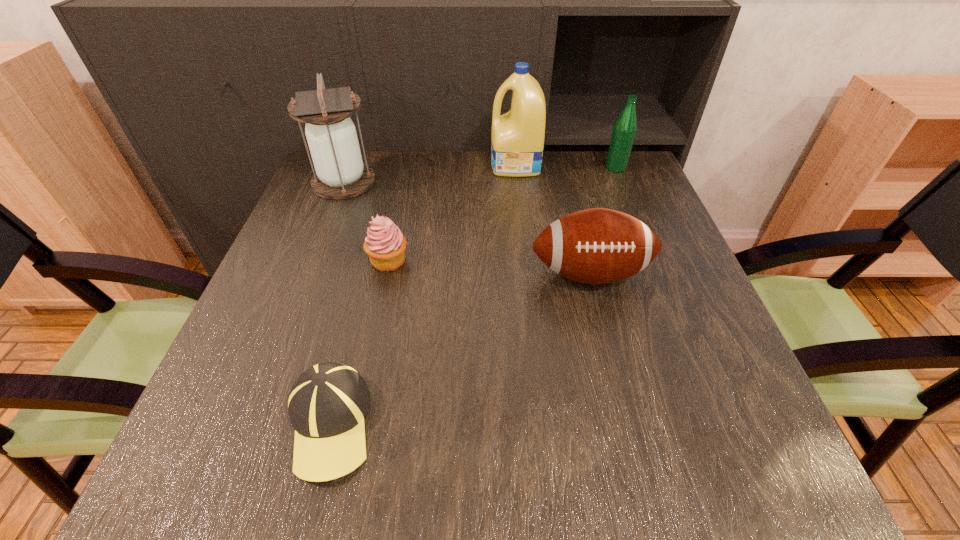
This screenshot has height=540, width=960. What are the coordinates of `bottle positioned at the right edge` in the screenshot? It's located at (625, 127).

Find the location of a particular element. This screenshot has width=960, height=540. football present at the right edge is located at coordinates coord(596,246).

At what (x,y) coordinates should I click in order to perform the action: click on object situated at the far left corner. Please return your answer as a coordinate pair (x, y). Looking at the image, I should click on (340, 173).

Locate an element on the screen. This screenshot has width=960, height=540. object located at the near left corner is located at coordinates (327, 404).

This screenshot has height=540, width=960. I want to click on object positioned at the far right corner, so click(x=625, y=127).

Where is `vacant space at the far edge`? vacant space at the far edge is located at coordinates (434, 178).

At what (x,y) coordinates should I click in order to perform the action: click on free space at the near edge. Please return your answer as a coordinate pair (x, y). Image resolution: width=960 pixels, height=540 pixels. Looking at the image, I should click on (663, 461).

Image resolution: width=960 pixels, height=540 pixels. Identify the location of vacant area at the left edge. (353, 227).

The width and height of the screenshot is (960, 540). In order to click on vacant space at the right edge of the desktop in this screenshot , I will do `click(746, 420)`.

The width and height of the screenshot is (960, 540). In the image, there is a desktop. In order to click on vacant space at the far right corner in this screenshot , I will do `click(640, 178)`.